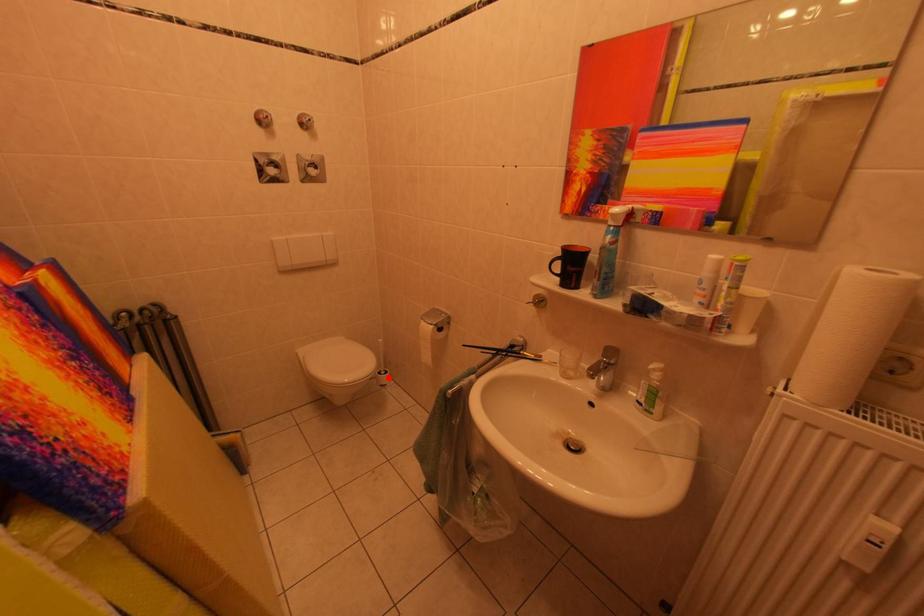
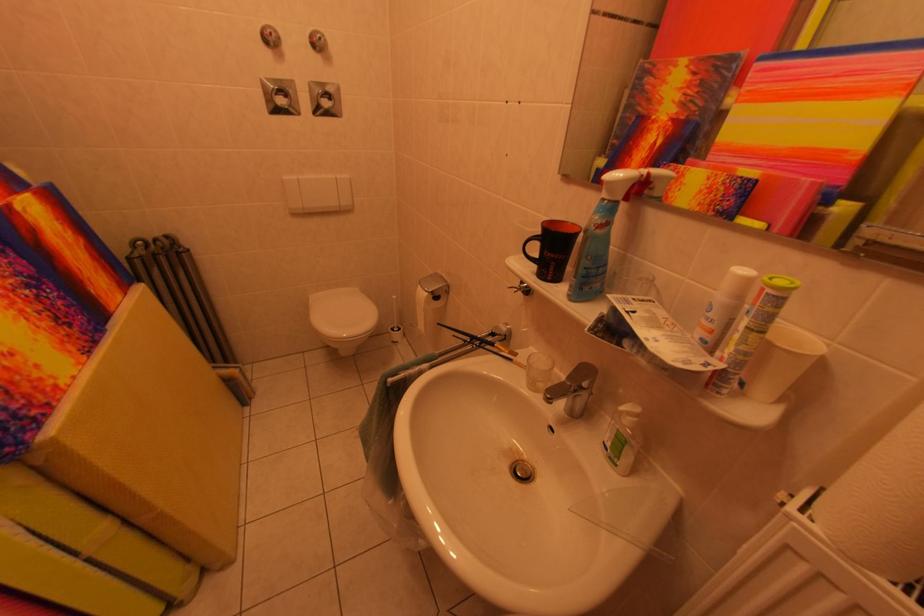
Find the pixel in the second image that matches the highlighted location in the first image.

(402, 333)